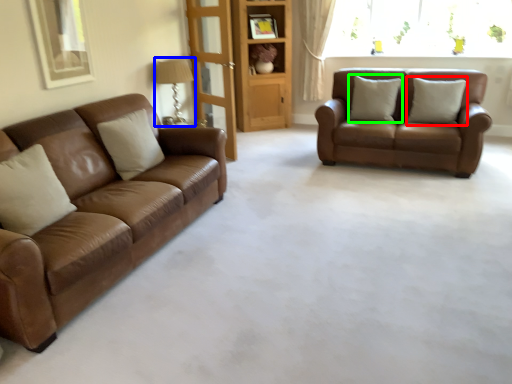
Question: Considering the real-world distances, which object is farthest from pillow (highlighted by a red box)? lamp (highlighted by a blue box) or pillow (highlighted by a green box)?

Choices:
 (A) lamp
 (B) pillow

Answer: (A)